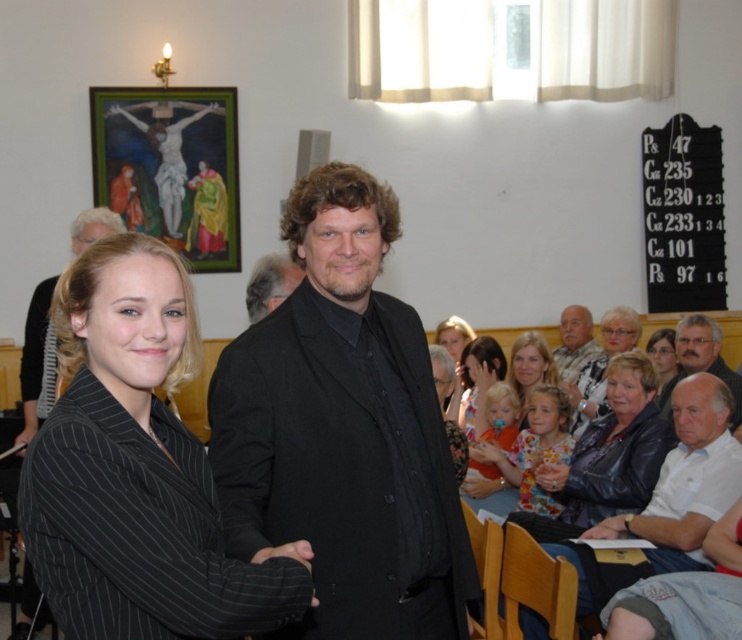
What is located at the coordinate point (686, 480) in the image?

The smooth black shirt at lower right is located at the coordinate point (686, 480).

You are an event photographer at the event and need to capture a closeup shot of both the gray hair man at lower right and the smooth blonde hair at center. Since your camera can only focus on one subject at a time, which person should you choose to ensure the subject is in focus given their sizes?

The gray hair man at lower right has a larger size compared to smooth blonde hair at center, so you should focus on the gray hair man at lower right to ensure the subject is in focus because larger subjects are easier to capture in focus with a single focus point.